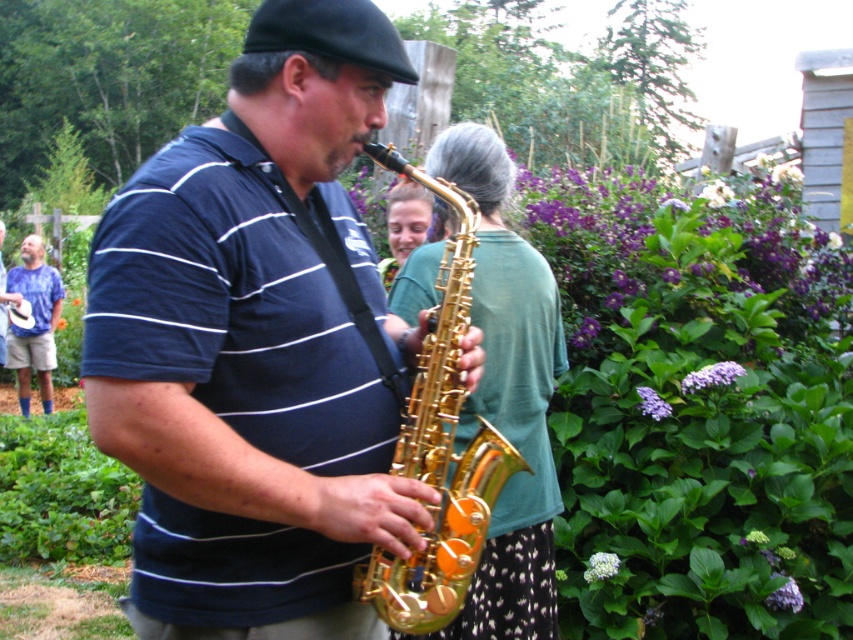
Question: Can you confirm if shiny gold saxophone at center is positioned to the right of matte green shirt at center?

Choices:
 (A) yes
 (B) no

Answer: (B)

Question: Which point is farther from the camera taking this photo?

Choices:
 (A) click(39, 369)
 (B) click(525, 448)

Answer: (A)

Question: From the image, what is the correct spatial relationship of shiny gold saxophone at center in relation to blue tie-dye shirt at left?

Choices:
 (A) below
 (B) above

Answer: (A)

Question: Which point is farther to the camera?

Choices:
 (A) blue tie-dye shirt at left
 (B) matte green shirt at center

Answer: (A)

Question: Is matte green shirt at center closer to the viewer compared to blue tie-dye shirt at left?

Choices:
 (A) no
 (B) yes

Answer: (B)

Question: Which point appears closest to the camera in this image?

Choices:
 (A) (476, 152)
 (B) (39, 282)
 (C) (373, 323)

Answer: (C)